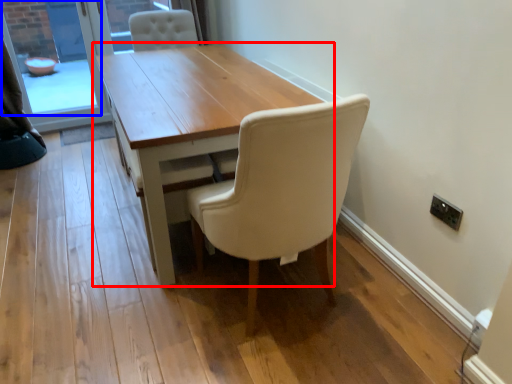
Question: Which of the following is the farthest to the observer, table (highlighted by a red box) or window screen (highlighted by a blue box)?

Choices:
 (A) table
 (B) window screen

Answer: (B)